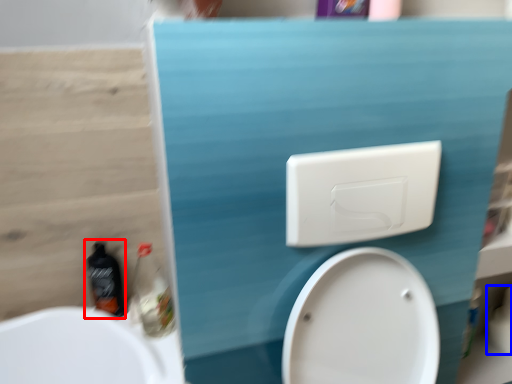
Question: Which object appears farthest to the camera in this image, bottle (highlighted by a red box) or toilet paper (highlighted by a blue box)?

Choices:
 (A) bottle
 (B) toilet paper

Answer: (B)